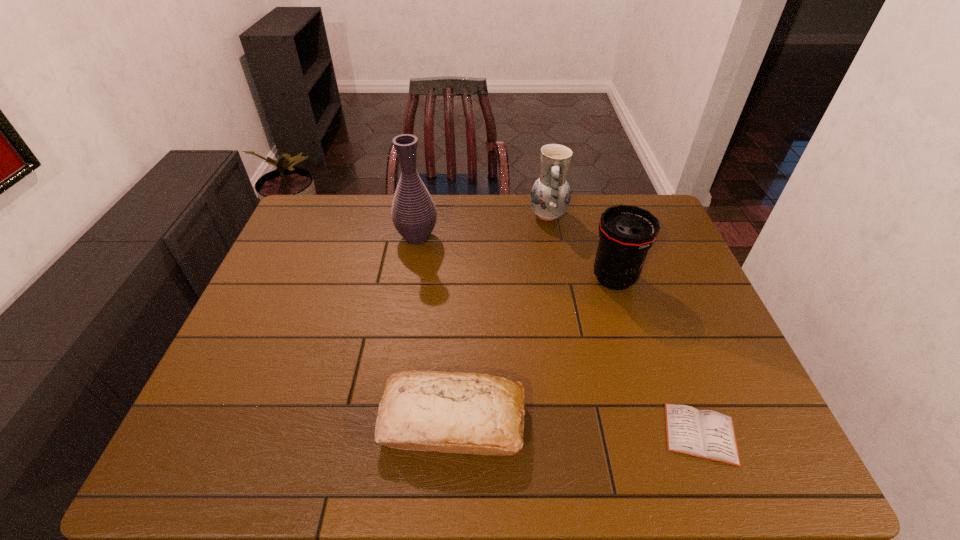
Where is `the tallest object`? the tallest object is located at coordinates (414, 215).

I want to click on pottery, so click(550, 196).

The height and width of the screenshot is (540, 960). I want to click on the third object from left to right, so click(550, 196).

Find the location of a particular element. This screenshot has height=540, width=960. the third shortest object is located at coordinates (626, 232).

Locate an element on the screen. The height and width of the screenshot is (540, 960). telephoto lens is located at coordinates (626, 232).

Where is `bread`? bread is located at coordinates (466, 413).

Where is `the shortest object`? The width and height of the screenshot is (960, 540). the shortest object is located at coordinates (706, 434).

This screenshot has height=540, width=960. I want to click on vacant space located on the left of the vase, so click(347, 238).

The width and height of the screenshot is (960, 540). In order to click on vacant space located on either side of the second tallest object in this screenshot , I will do `click(417, 215)`.

This screenshot has height=540, width=960. Find the location of `free space located 0.350m on either side of the second tallest object`. free space located 0.350m on either side of the second tallest object is located at coordinates (428, 215).